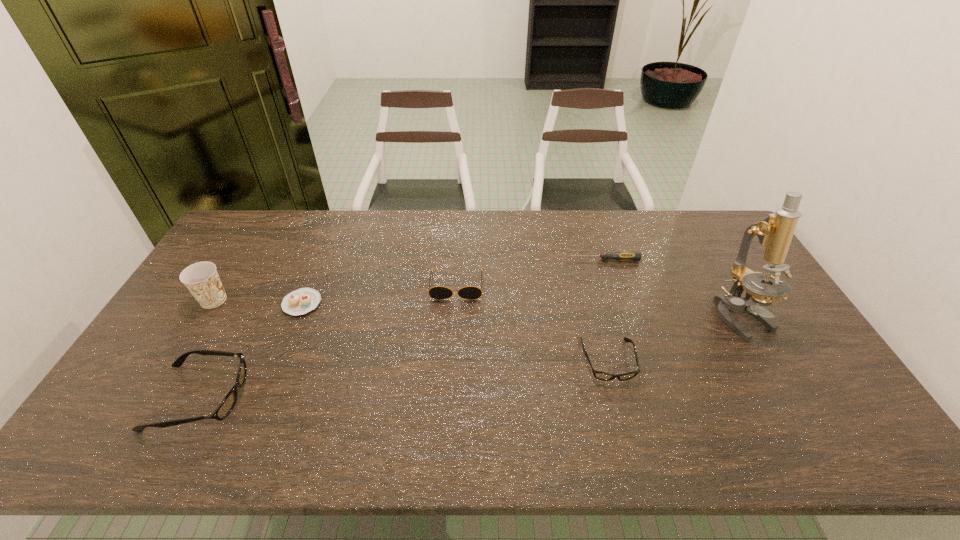
Where is `object that is at the right edge`? object that is at the right edge is located at coordinates (775, 232).

Where is `object at the near left corner`? This screenshot has height=540, width=960. object at the near left corner is located at coordinates (226, 406).

At what (x,y) coordinates should I click in order to perform the action: click on free space at the far edge of the desktop. Please return your answer as a coordinate pair (x, y). This screenshot has height=540, width=960. Looking at the image, I should click on (636, 237).

Find the location of a particular element. The height and width of the screenshot is (540, 960). blank space at the near edge is located at coordinates (489, 410).

At what (x,y) coordinates should I click in order to perform the action: click on free space at the right edge of the desktop. Please return your answer as a coordinate pair (x, y). The height and width of the screenshot is (540, 960). Looking at the image, I should click on (709, 262).

You are a GUI agent. You are given a task and a screenshot of the screen. Output one action in this format:
    pyautogui.click(x=<x>, y=<y>)
    Task: Click on the vacant space at the near left corner of the desktop
    This screenshot has height=540, width=960.
    Given the screenshot: What is the action you would take?
    pyautogui.click(x=152, y=413)

The height and width of the screenshot is (540, 960). In the image, there is a desktop. Identify the location of free space at the far right corner. (692, 222).

Where is `free spot between the cupcake and the fourth object from right to left`? This screenshot has height=540, width=960. free spot between the cupcake and the fourth object from right to left is located at coordinates (379, 294).

This screenshot has width=960, height=540. I want to click on empty location between the fourth object from right to left and the shorter spectacles, so click(x=532, y=323).

Where is `free space between the cupcake and the left spectacles`? This screenshot has height=540, width=960. free space between the cupcake and the left spectacles is located at coordinates (251, 350).